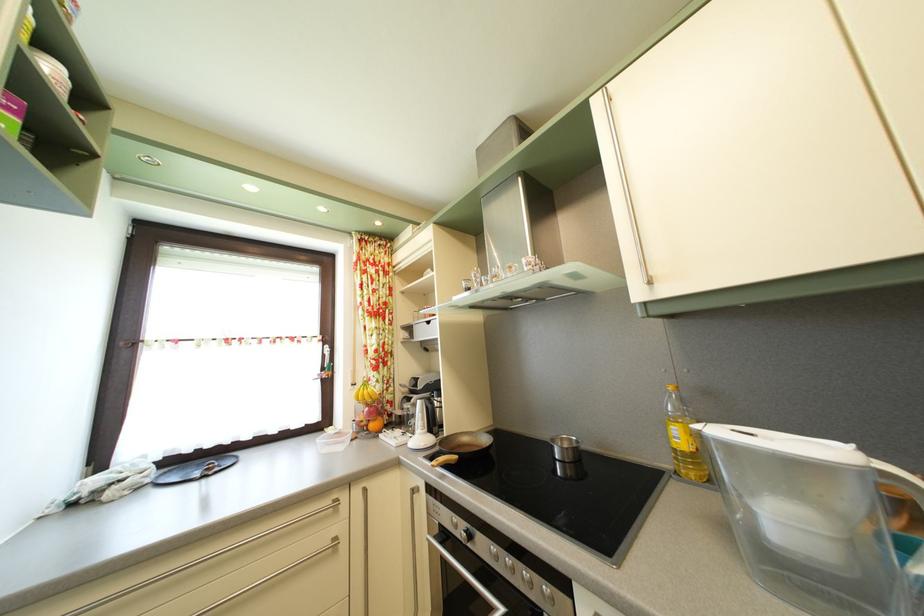
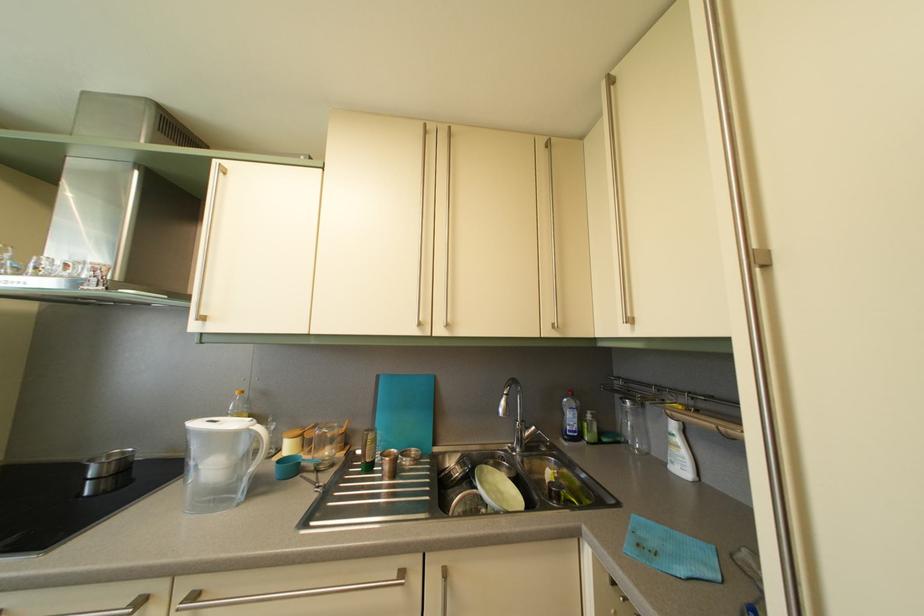
In the second image, find the point that corresponds to [569,448] in the first image.

(118, 463)